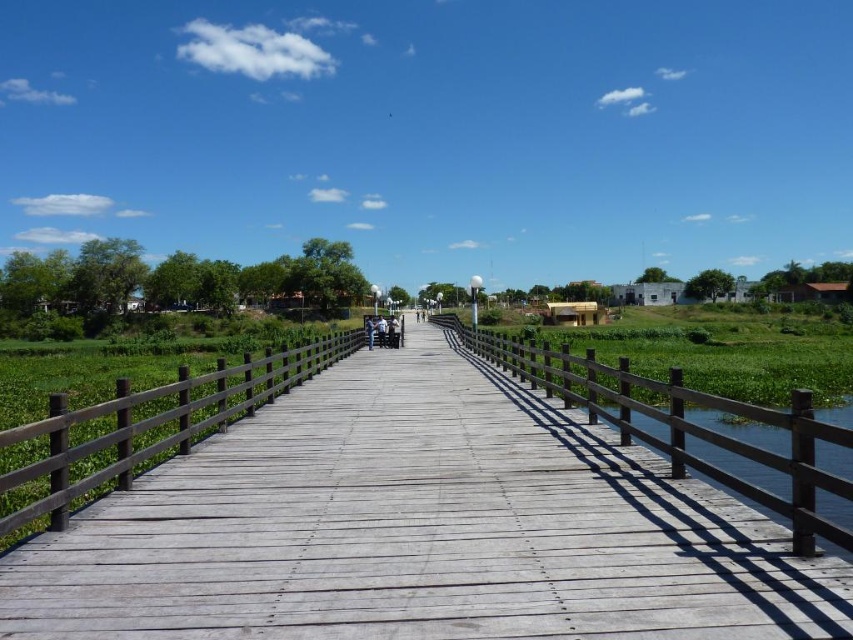
You are a hiker carrying a 2m long wooden plank. You need to cross the weathered wood bridge at center and place the plank on the clear water at right. Can the bridge support the plank? Please explain based on their widths.

The weathered wood bridge at center has a lesser width compared to clear water at right. Since the bridge is narrower than the water area, the bridge may not have enough space to safely support the 2m long plank. It is advisable to find an alternative location or method for placing the plank.

You are a hiker carrying a 1.8 meter long backpack. You come across the weathered wood bridge at center and the clear water at right. Which one can you safely step over without needing to lower your backpack?

The weathered wood bridge at center is shorter than clear water at right, so you can safely step over the weathered wood bridge at center without needing to lower your backpack.

Looking at this image, you are standing on the wooden boardwalk and want to cross to the other side of the clear water at right. The weathered wood bridge at center is your only option. Is the bridge positioned to the left or right of the water?

→ The weathered wood bridge at center is to the left of the clear water at right, so you should head towards the bridge located to the left side of the water to cross.